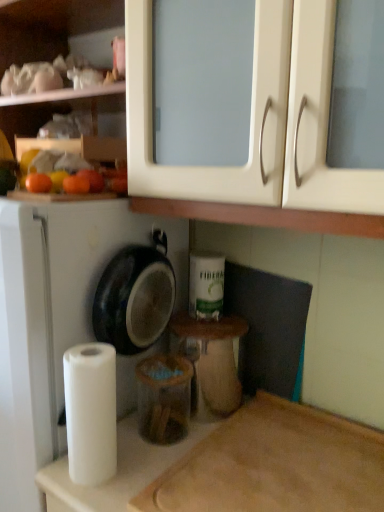
The width and height of the screenshot is (384, 512). What are the coordinates of `free space above wooden cutting board at lower right (from a real-world perspective)` in the screenshot? It's located at (289, 462).